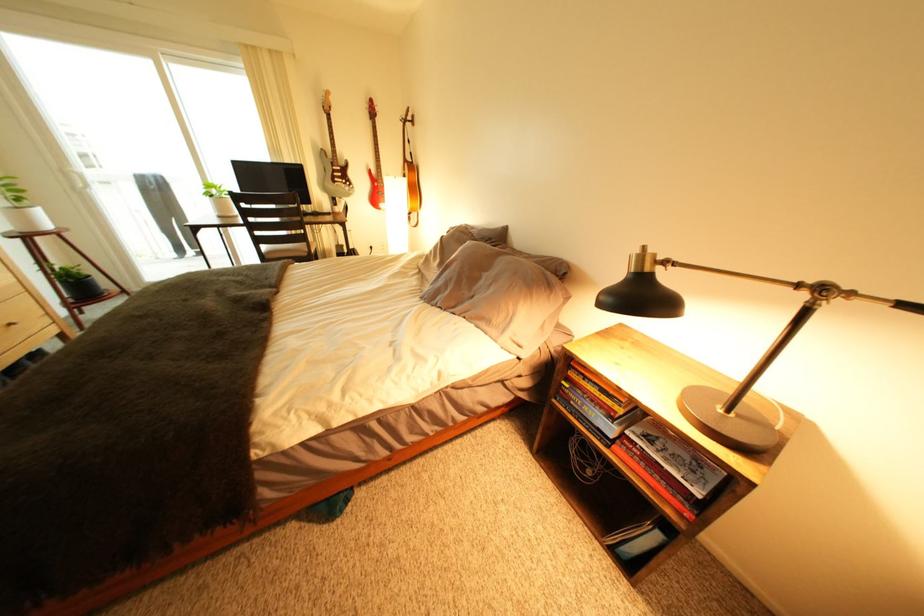
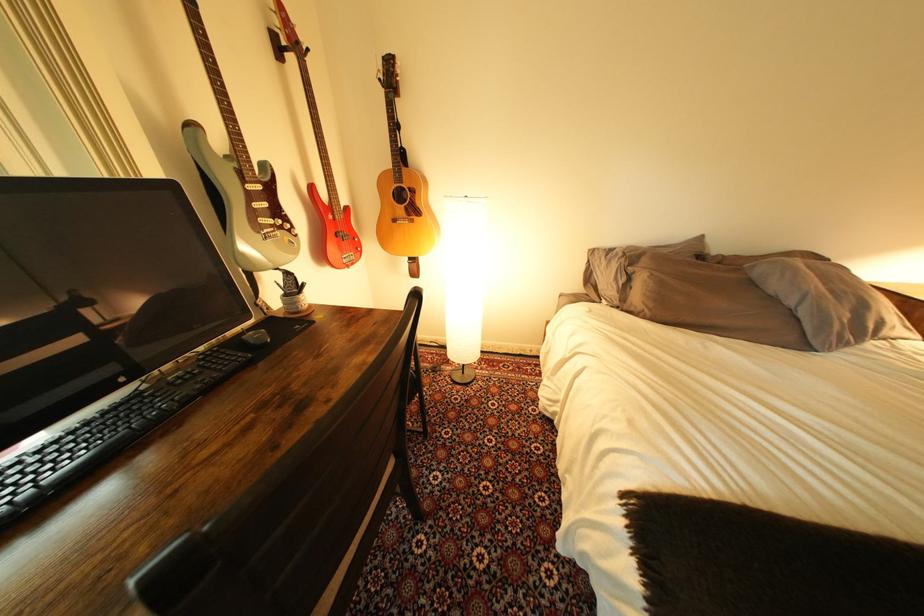
Where in the second image is the point corresponding to point (349, 185) from the first image?

(278, 233)